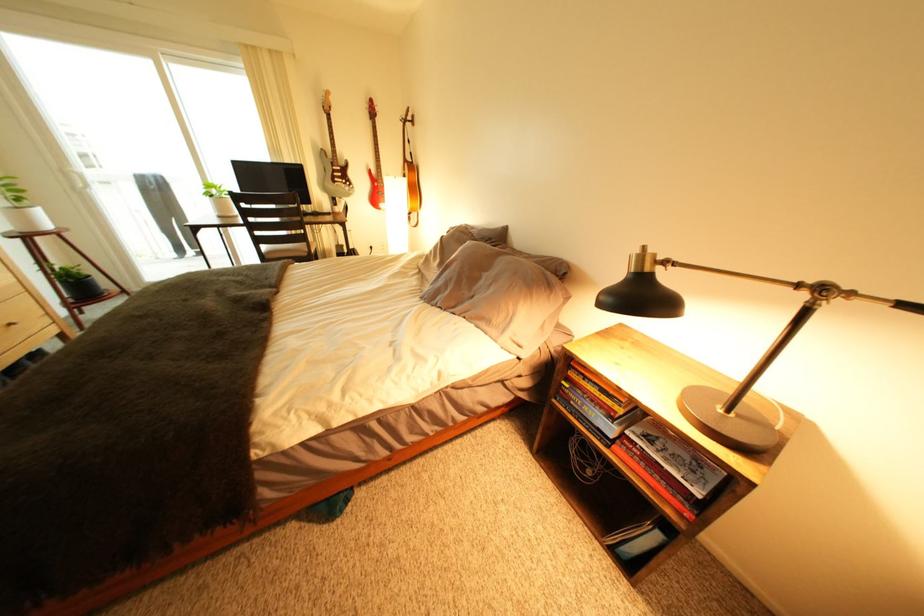
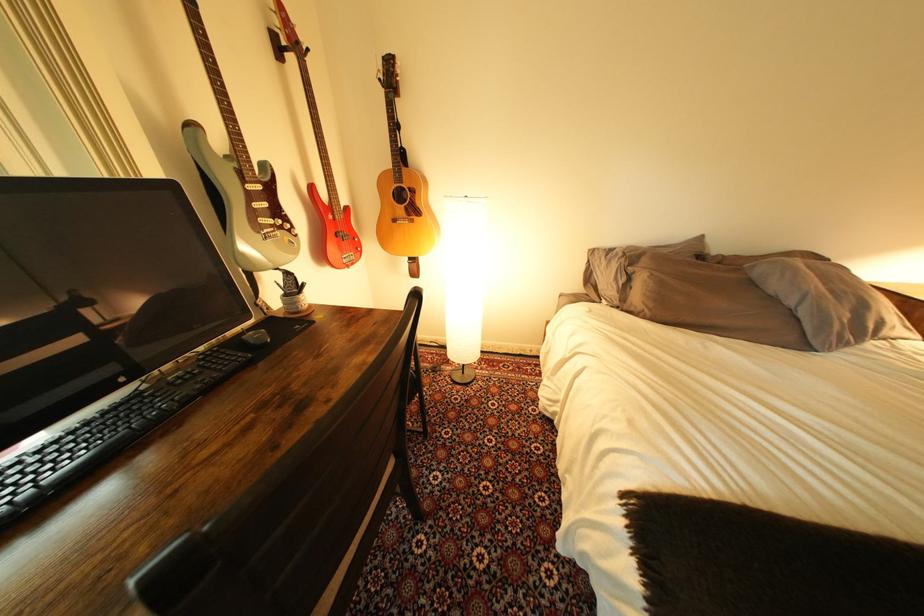
Where in the second image is the point corresponding to point (349, 185) from the first image?

(278, 233)